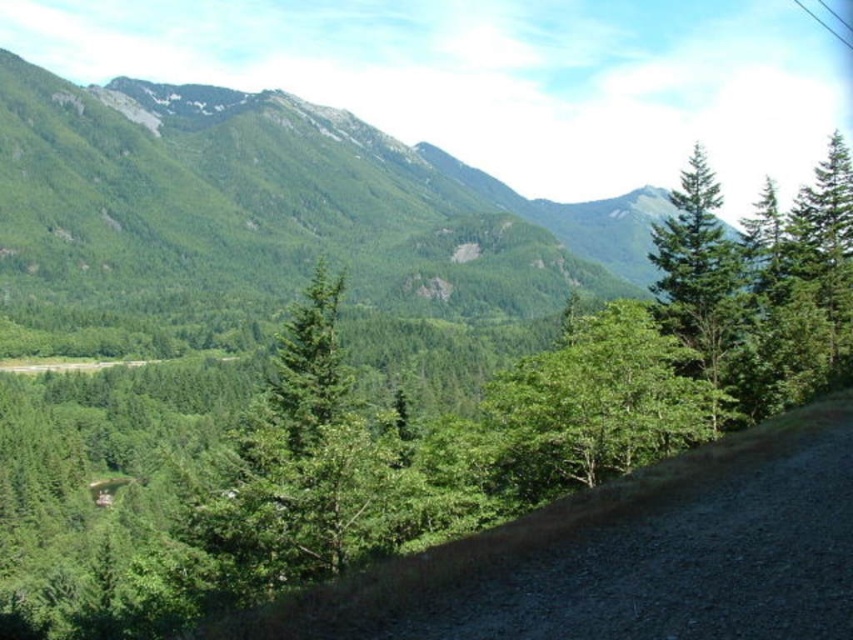
Question: Which of the following is the farthest from the observer?

Choices:
 (A) (637, 280)
 (B) (682, 272)
 (C) (225, 620)
 (D) (648, 310)

Answer: (A)

Question: Which point is closer to the camera taking this photo?

Choices:
 (A) (665, 276)
 (B) (227, 628)

Answer: (B)

Question: Is green forested mountain at upper center above green matte tree at upper right?

Choices:
 (A) yes
 (B) no

Answer: (A)

Question: Observing the image, what is the correct spatial positioning of green forested mountain at upper center in reference to dirt/gravel path at lower right?

Choices:
 (A) right
 (B) left

Answer: (B)

Question: Which is farther from the green forested mountain at upper center?

Choices:
 (A) dirt/gravel path at lower right
 (B) green matte tree at upper right

Answer: (B)

Question: Does dirt/gravel path at lower right appear on the left side of green matte tree at upper right?

Choices:
 (A) no
 (B) yes

Answer: (B)